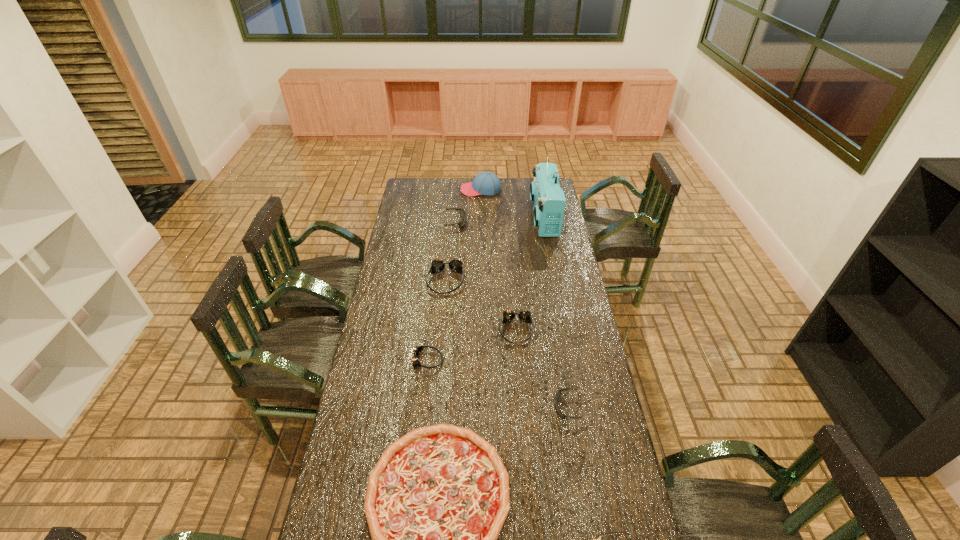
Find the location of `goggles located in the right edge section of the desktop`. goggles located in the right edge section of the desktop is located at coordinates (558, 394).

Image resolution: width=960 pixels, height=540 pixels. Identify the location of object present at the far right corner. (548, 198).

Find the location of a particular element. This screenshot has height=540, width=960. vacant space at the left edge of the desktop is located at coordinates (402, 306).

In the image, there is a desktop. Identify the location of vacant space at the right edge. (567, 274).

The image size is (960, 540). I want to click on empty location between the nearest bronze goggles and the tallest goggles, so click(436, 320).

I want to click on empty location between the seventh shortest object and the bigger black goggles, so pyautogui.click(x=448, y=252).

Where is `empty space that is in between the bigger black goggles and the fifth farthest object`? Image resolution: width=960 pixels, height=540 pixels. empty space that is in between the bigger black goggles and the fifth farthest object is located at coordinates (484, 276).

The height and width of the screenshot is (540, 960). I want to click on unoccupied area between the tallest goggles and the farthest object, so click(x=463, y=235).

The width and height of the screenshot is (960, 540). Find the location of `empty space between the second farthest goggles and the left black goggles`. empty space between the second farthest goggles and the left black goggles is located at coordinates click(x=448, y=252).

Where is `object that stands as the seventh closest to the second nearest bronze goggles`? The width and height of the screenshot is (960, 540). object that stands as the seventh closest to the second nearest bronze goggles is located at coordinates (598, 539).